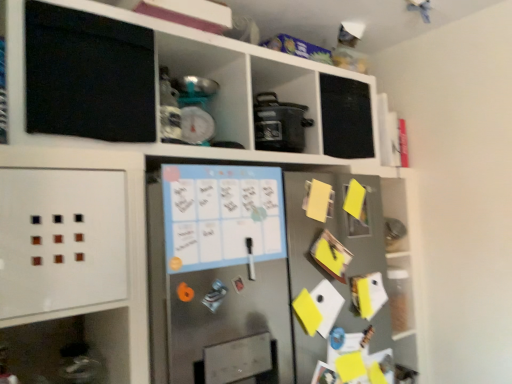
Question: Is matte black pot at center not close to yellow paper at right?

Choices:
 (A) yes
 (B) no

Answer: (B)

Question: Is matte black pot at center bigger than yellow paper at right?

Choices:
 (A) yes
 (B) no

Answer: (A)

Question: From the image's perspective, is matte black pot at center on yellow paper at right?

Choices:
 (A) no
 (B) yes

Answer: (B)

Question: Is matte black pot at center outside of yellow paper at right?

Choices:
 (A) yes
 (B) no

Answer: (A)

Question: Is matte black pot at center further to camera compared to yellow paper at right?

Choices:
 (A) no
 (B) yes

Answer: (B)

Question: Considering the positions of matte black pot at center and stainless steel fridge at center in the image, is matte black pot at center taller or shorter than stainless steel fridge at center?

Choices:
 (A) short
 (B) tall

Answer: (A)

Question: From a real-world perspective, is matte black pot at center physically located above or below stainless steel fridge at center?

Choices:
 (A) below
 (B) above

Answer: (B)

Question: Is point pyautogui.click(x=259, y=127) closer or farther from the camera than point pyautogui.click(x=315, y=312)?

Choices:
 (A) farther
 (B) closer

Answer: (A)

Question: From the image's perspective, is matte black pot at center above or below stainless steel fridge at center?

Choices:
 (A) below
 (B) above

Answer: (B)

Question: Is yellow paper at right wider or thinner than matte black pot at center?

Choices:
 (A) thin
 (B) wide

Answer: (A)

Question: Is yellow paper at right spatially inside matte black pot at center, or outside of it?

Choices:
 (A) outside
 (B) inside

Answer: (A)

Question: From a real-world perspective, is yellow paper at right physically located above or below matte black pot at center?

Choices:
 (A) below
 (B) above

Answer: (A)

Question: Looking at the image, does yellow paper at right seem bigger or smaller compared to matte black pot at center?

Choices:
 (A) big
 (B) small

Answer: (B)

Question: Is stainless steel fridge at center spatially inside matte black pot at center, or outside of it?

Choices:
 (A) outside
 (B) inside

Answer: (A)

Question: Is stainless steel fridge at center wider or thinner than matte black pot at center?

Choices:
 (A) wide
 (B) thin

Answer: (A)